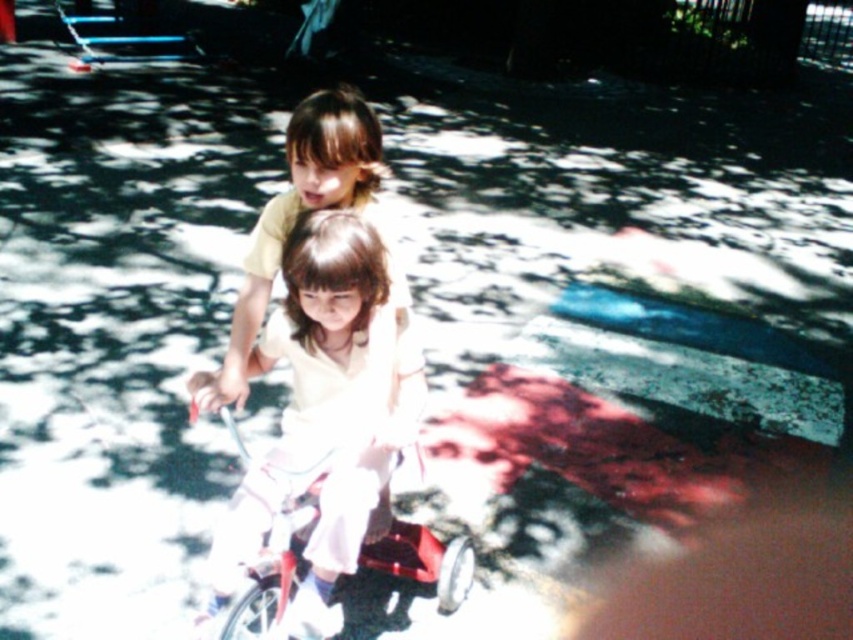
Question: Which point is closer to the camera taking this photo?

Choices:
 (A) (357, 227)
 (B) (438, 564)

Answer: (A)

Question: Does matte white shirt at center appear on the right side of metallic red bicycle at center?

Choices:
 (A) yes
 (B) no

Answer: (B)

Question: Which point appears closest to the camera in this image?

Choices:
 (A) (346, 104)
 (B) (413, 550)

Answer: (A)

Question: In this image, where is matte white shirt at center located relative to metallic red bicycle at center?

Choices:
 (A) above
 (B) below

Answer: (A)

Question: Is matte white shirt at center to the right of metallic red bicycle at center from the viewer's perspective?

Choices:
 (A) no
 (B) yes

Answer: (A)

Question: Among these points, which one is nearest to the camera?

Choices:
 (A) (247, 570)
 (B) (302, 221)

Answer: (B)